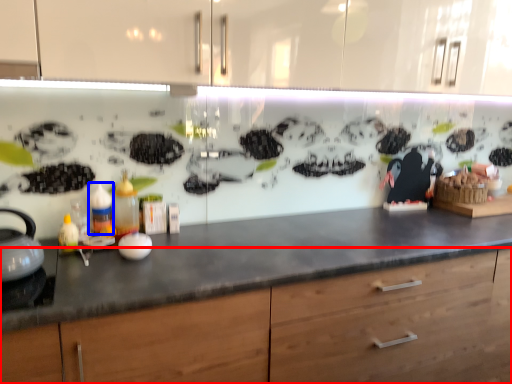
Question: Which object appears closest to the camera in this image, cabinetry (highlighted by a red box) or bottle (highlighted by a blue box)?

Choices:
 (A) cabinetry
 (B) bottle

Answer: (A)